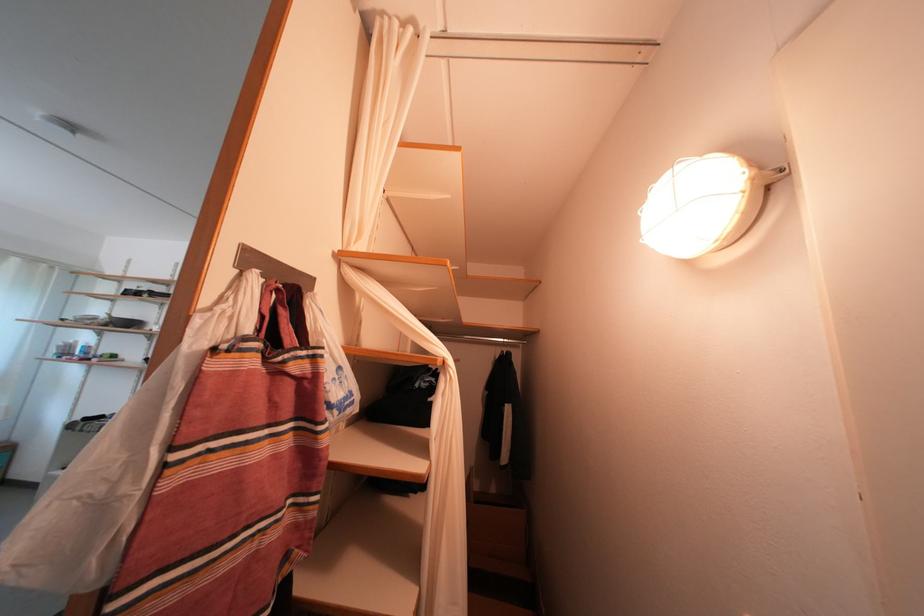
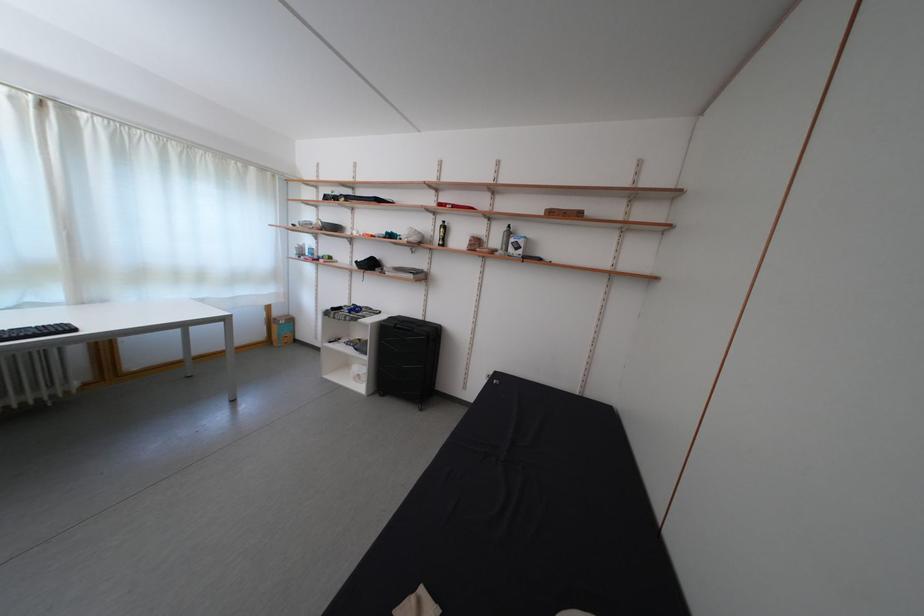
Find the pixel in the second image that matches [107,315] in the first image.

(319, 221)